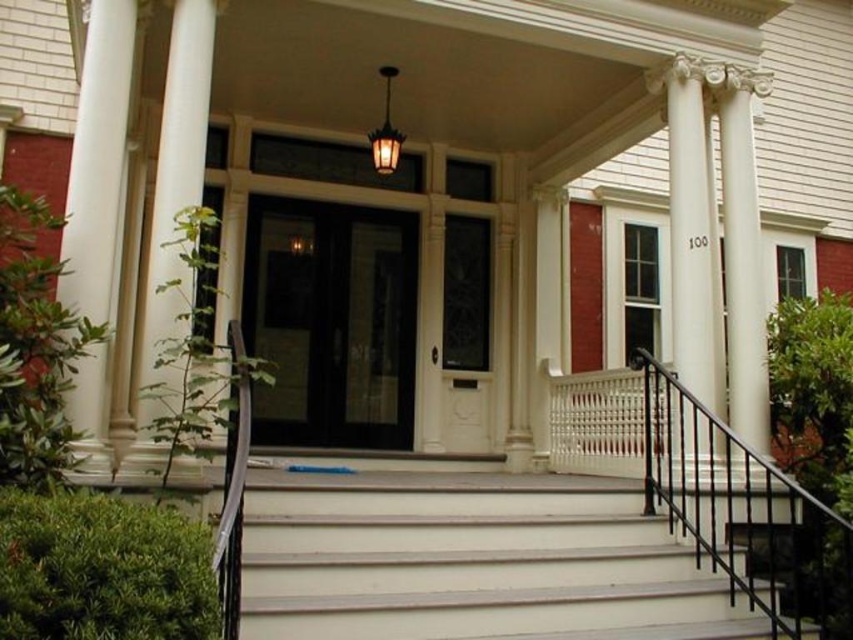
Question: Is white painted wood stairs at center thinner than white smooth column at left?

Choices:
 (A) no
 (B) yes

Answer: (A)

Question: Which point appears closest to the camera in this image?

Choices:
 (A) (80, 64)
 (B) (756, 83)
 (C) (339, 554)
 (D) (695, 282)

Answer: (C)

Question: Is white painted wood stairs at center closer to the viewer compared to white smooth column at center?

Choices:
 (A) yes
 (B) no

Answer: (A)

Question: Based on their relative distances, which object is farther from the white painted wood stairs at center?

Choices:
 (A) white smooth column at center
 (B) white smooth column at right
 (C) white smooth column at left

Answer: (C)

Question: Which object is the farthest from the white smooth column at left?

Choices:
 (A) white smooth column at right
 (B) white smooth column at center

Answer: (A)

Question: Is white smooth column at center closer to camera compared to white smooth column at right?

Choices:
 (A) no
 (B) yes

Answer: (B)